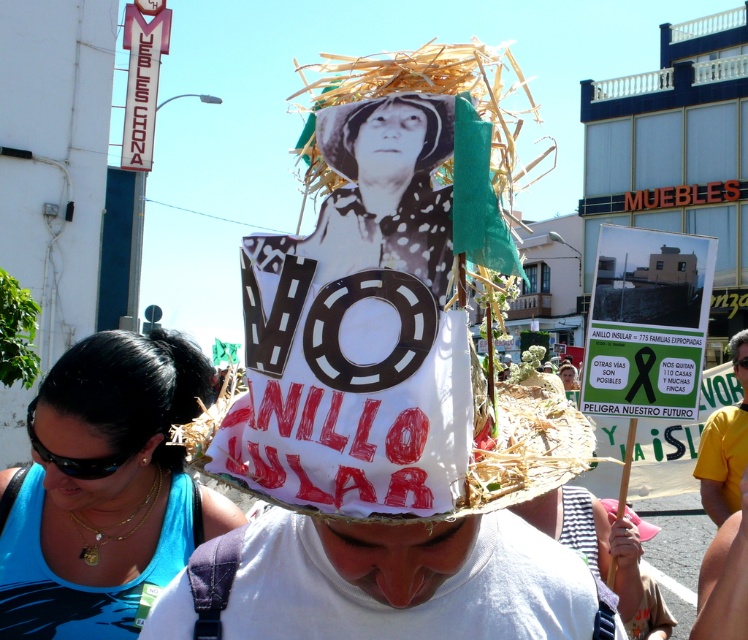
You are a photographer standing at the edge of the protest scene. You want to capture a photo that includes both the blue fabric at lower left and the black paper head at center. What is the minimum distance you need to move backward to ensure both objects are in frame?

The blue fabric at lower left is 5.10 feet from the black paper head at center. To capture both in the frame, you need to move back at least 5.10 feet to ensure both are visible.

You are a photographer trying to capture the protest scene. You want to ensure both the blue fabric at lower left and the black paper head at center are clearly visible in your shot. Based on their sizes, which object should you focus on first to ensure it fits within the frame?

The blue fabric at lower left might be wider than the black paper head at center, so focusing on the blue fabric at lower left first would ensure it fits within the frame.

You are a photographer standing at the center of the protest scene. You want to take a photo that includes both the black paper head at center and the black plastic goggles at lower left. Given the distance between them, will you need to adjust your camera to a wider angle to capture both in the frame?

The black paper head at center is 4.92 feet away from the black plastic goggles at lower left. To capture both in the frame, you would need to adjust your camera to a wider angle since the distance between them requires a broader field of view.